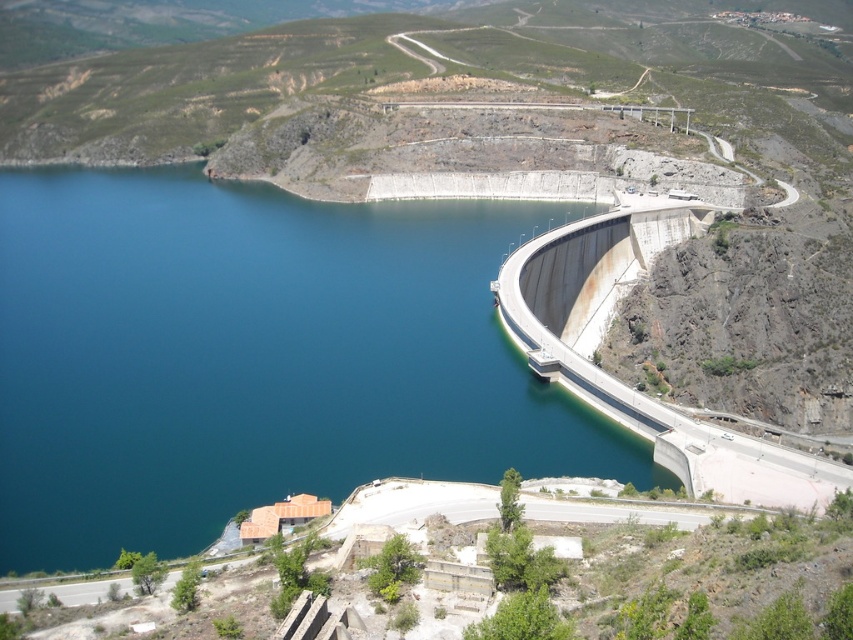
I want to click on blue concrete dam at center, so click(254, 356).

Where is `blue concrete dam at center`? Image resolution: width=853 pixels, height=640 pixels. blue concrete dam at center is located at coordinates (254, 356).

Where is `blue concrete dam at center`? This screenshot has width=853, height=640. blue concrete dam at center is located at coordinates (254, 356).